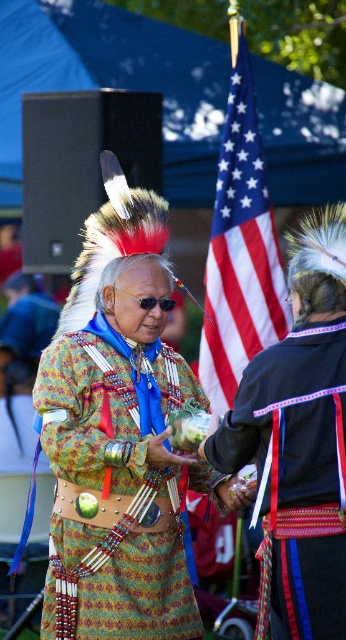
Question: Is the position of shiny black headdress at center more distant than that of patterned fabric headdress at center?

Choices:
 (A) yes
 (B) no

Answer: (B)

Question: Which object appears farthest from the camera in this image?

Choices:
 (A) american flag at center
 (B) multicolored woven fabric at center

Answer: (A)

Question: Observing the image, what is the correct spatial positioning of multicolored woven fabric at center in reference to american flag at center?

Choices:
 (A) above
 (B) below

Answer: (B)

Question: Which of the following is the farthest from the observer?

Choices:
 (A) shiny black headdress at center
 (B) american flag at center
 (C) patterned fabric headdress at center

Answer: (C)

Question: Which object appears closest to the camera in this image?

Choices:
 (A) shiny black headdress at center
 (B) patterned fabric headdress at center
 (C) american flag at center

Answer: (A)

Question: Can you confirm if american flag at center is smaller than patterned fabric headdress at center?

Choices:
 (A) yes
 (B) no

Answer: (A)